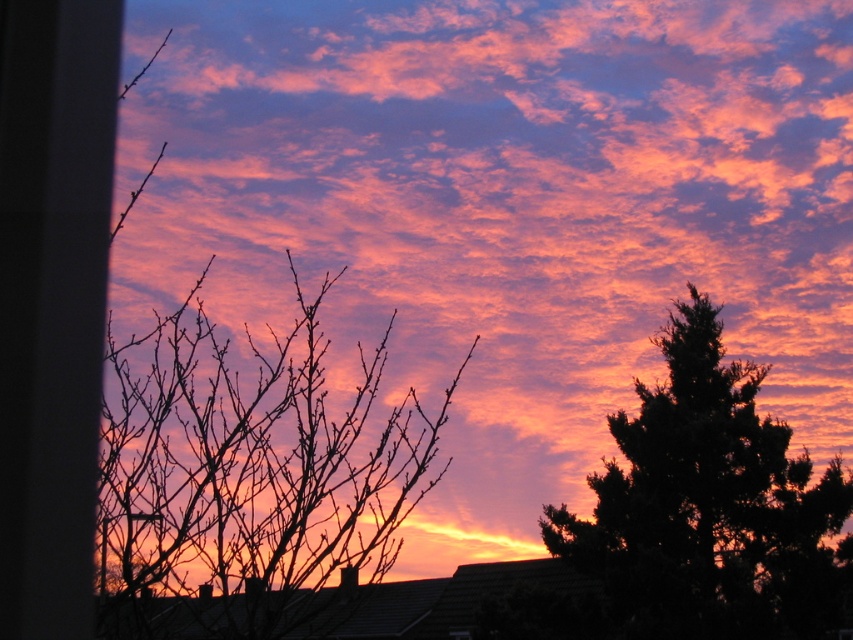
You are an astronomer trying to locate a specific point in the sunset scene. According to the coordinates provided, where exactly is the silhouette branches at left located?

The silhouette branches at left are located at point (248, 481).

You are an artist trying to paint the sunset scene. You want to ensure the proportions between the silhouette branches at left and the dark green textured tree at right match the actual image. Based on the scene description, which object should you draw first to maintain proper scaling?

A: The silhouette branches at left should be drawn first since it is shorter than the dark green textured tree at right, allowing you to establish the smaller size before scaling up for the taller tree.